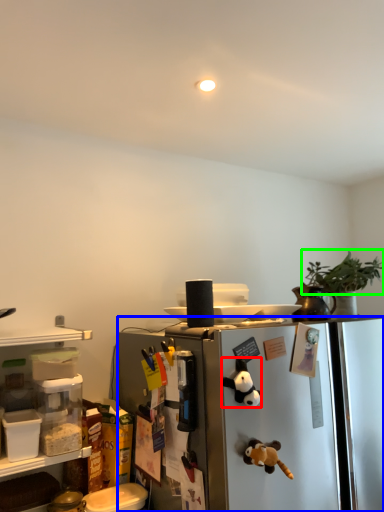
Question: Based on their relative distances, which object is nearer to toy (highlighted by a red box)? Choose from refrigerator (highlighted by a blue box) and plant (highlighted by a green box).

Choices:
 (A) refrigerator
 (B) plant

Answer: (A)